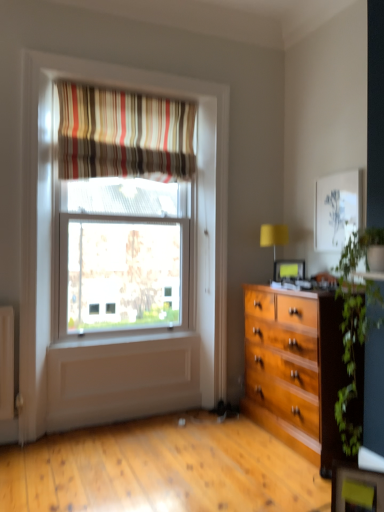
In order to face striped fabric curtain at upper center, should I rotate leftwards or rightwards?

You should look left and rotate roughly 8.116 degrees.

Looking at this image, measure the distance between yellow fabric lampshade at right and camera.

The depth of yellow fabric lampshade at right is 3.31 meters.

This screenshot has height=512, width=384. Find the location of `green leafy plant at right`. green leafy plant at right is located at coordinates (355, 327).

In the scene shown: Considering the sizes of objects yellow fabric lampshade at right and green leafy plant at right in the image provided, who is shorter, yellow fabric lampshade at right or green leafy plant at right?

Standing shorter between the two is yellow fabric lampshade at right.

Is yellow fabric lampshade at right wider or thinner than green leafy plant at right?

In the image, yellow fabric lampshade at right appears to be more narrow than green leafy plant at right.

What's the angular difference between yellow fabric lampshade at right and green leafy plant at right's facing directions?

0.0728 degrees.

At what (x,y) coordinates should I click in order to perform the action: click on plant below the yellow fabric lampshade at right (from a real-world perspective). Please return your answer as a coordinate pair (x, y). Image resolution: width=384 pixels, height=512 pixels. Looking at the image, I should click on (355, 327).

Is matte black picture frame at center positioned with its back to yellow fabric lampshade at right?

Yes, yellow fabric lampshade at right is at the back of matte black picture frame at center.

From a real-world perspective, does matte black picture frame at center sit lower than yellow fabric lampshade at right?

Correct, in the physical world, matte black picture frame at center is lower than yellow fabric lampshade at right.

From the image's perspective, is matte black picture frame at center below yellow fabric lampshade at right?

Yes, from the image's perspective, matte black picture frame at center is beneath yellow fabric lampshade at right.

Can you confirm if matte black picture frame at center is positioned to the left of yellow fabric lampshade at right?

In fact, matte black picture frame at center is to the right of yellow fabric lampshade at right.

Is point (268, 244) farther from camera compared to point (171, 157)?

That is True.

From a real-world perspective, does yellow fabric lampshade at right stand above striped fabric curtain at upper center?

No, from a real-world perspective, yellow fabric lampshade at right is not over striped fabric curtain at upper center

From the image's perspective, would you say yellow fabric lampshade at right is positioned over striped fabric curtain at upper center?

No, from the image's perspective, yellow fabric lampshade at right is not on top of striped fabric curtain at upper center.

Who is smaller, yellow fabric lampshade at right or striped fabric curtain at upper center?

yellow fabric lampshade at right.

Would you say green leafy plant at right is outside yellow fabric lampshade at right?

Indeed, green leafy plant at right is completely outside yellow fabric lampshade at right.

Relative to yellow fabric lampshade at right, is green leafy plant at right in front or behind?

green leafy plant at right is positioned closer to the viewer than yellow fabric lampshade at right.

From a real-world perspective, is green leafy plant at right positioned over yellow fabric lampshade at right based on gravity?

Actually, green leafy plant at right is physically below yellow fabric lampshade at right in the real world.

How different are the orientations of green leafy plant at right and yellow fabric lampshade at right in degrees?

The facing directions of green leafy plant at right and yellow fabric lampshade at right are 0.0728 degrees apart.

Considering the relative positions of striped fabric curtain at upper center and yellow fabric lampshade at right in the image provided, is striped fabric curtain at upper center to the left of yellow fabric lampshade at right from the viewer's perspective?

Correct, you'll find striped fabric curtain at upper center to the left of yellow fabric lampshade at right.

Is point (130, 125) farther from camera compared to point (266, 234)?

That is False.

Is there a large distance between striped fabric curtain at upper center and yellow fabric lampshade at right?

Yes, striped fabric curtain at upper center and yellow fabric lampshade at right are located far from each other.

Between striped fabric curtain at upper center and yellow fabric lampshade at right, which one has less height?

yellow fabric lampshade at right is shorter.

Considering the positions of point (131, 166) and point (348, 298), is point (131, 166) closer or farther from the camera than point (348, 298)?

Point (131, 166) is positioned farther from the camera compared to point (348, 298).

Considering the relative sizes of striped fabric curtain at upper center and green leafy plant at right in the image provided, is striped fabric curtain at upper center smaller than green leafy plant at right?

Indeed, striped fabric curtain at upper center has a smaller size compared to green leafy plant at right.

Is striped fabric curtain at upper center at the left side of green leafy plant at right?

Correct, you'll find striped fabric curtain at upper center to the left of green leafy plant at right.

Is striped fabric curtain at upper center oriented towards green leafy plant at right?

No, striped fabric curtain at upper center is not turned towards green leafy plant at right.

Image resolution: width=384 pixels, height=512 pixels. In order to click on table lamp that is above the matte black picture frame at center (from a real-world perspective) in this screenshot , I will do `click(273, 236)`.

Does point (261, 234) come farther from viewer compared to point (278, 276)?

Yes, point (261, 234) is farther from viewer.

Between yellow fabric lampshade at right and matte black picture frame at center, which one has more height?

Standing taller between the two is yellow fabric lampshade at right.

Based on the photo, which object is positioned more to the left, yellow fabric lampshade at right or matte black picture frame at center?

From the viewer's perspective, yellow fabric lampshade at right appears more on the left side.

Where is `plant that is on the right side of yellow fabric lampshade at right`? The height and width of the screenshot is (512, 384). plant that is on the right side of yellow fabric lampshade at right is located at coordinates (355, 327).

You are a GUI agent. You are given a task and a screenshot of the screen. Output one action in this format:
    pyautogui.click(x=<x>, y=<y>)
    Task: Click on the table lamp on the left of matte black picture frame at center
    This screenshot has width=384, height=512.
    Given the screenshot: What is the action you would take?
    pyautogui.click(x=273, y=236)

Looking at the image, which one is located further to green leafy plant at right, matte black picture frame at center or yellow fabric lampshade at right?

Among the two, yellow fabric lampshade at right is located further to green leafy plant at right.

Looking at the image, which one is located further to matte black picture frame at center, striped fabric curtain at upper center or yellow fabric lampshade at right?

Based on the image, striped fabric curtain at upper center appears to be further to matte black picture frame at center.

Looking at the image, which one is located closer to striped fabric curtain at upper center, green leafy plant at right or yellow fabric lampshade at right?

The object closer to striped fabric curtain at upper center is yellow fabric lampshade at right.

Considering their positions, is matte black picture frame at center positioned closer to yellow fabric lampshade at right than green leafy plant at right?

matte black picture frame at center lies closer to yellow fabric lampshade at right than the other object.

From the image, which object appears to be farther from matte black picture frame at center, striped fabric curtain at upper center or green leafy plant at right?

Based on the image, striped fabric curtain at upper center appears to be further to matte black picture frame at center.

When comparing their distances from yellow fabric lampshade at right, does striped fabric curtain at upper center or green leafy plant at right seem further?

green leafy plant at right.

Which object lies further to the anchor point matte black picture frame at center, green leafy plant at right or striped fabric curtain at upper center?

Based on the image, striped fabric curtain at upper center appears to be further to matte black picture frame at center.

From the image, which object appears to be nearer to striped fabric curtain at upper center, yellow fabric lampshade at right or green leafy plant at right?

The object closer to striped fabric curtain at upper center is yellow fabric lampshade at right.

Where is `picture frame between green leafy plant at right and yellow fabric lampshade at right in the front-back direction`? picture frame between green leafy plant at right and yellow fabric lampshade at right in the front-back direction is located at coordinates (289, 269).

Find the location of a particular element. The height and width of the screenshot is (512, 384). table lamp between striped fabric curtain at upper center and matte black picture frame at center in the horizontal direction is located at coordinates (273, 236).

This screenshot has height=512, width=384. I want to click on table lamp located between striped fabric curtain at upper center and green leafy plant at right in the left-right direction, so 273,236.

You are a GUI agent. You are given a task and a screenshot of the screen. Output one action in this format:
    pyautogui.click(x=<x>, y=<y>)
    Task: Click on the picture frame between striped fabric curtain at upper center and green leafy plant at right from left to right
    Image resolution: width=384 pixels, height=512 pixels.
    Given the screenshot: What is the action you would take?
    pyautogui.click(x=289, y=269)